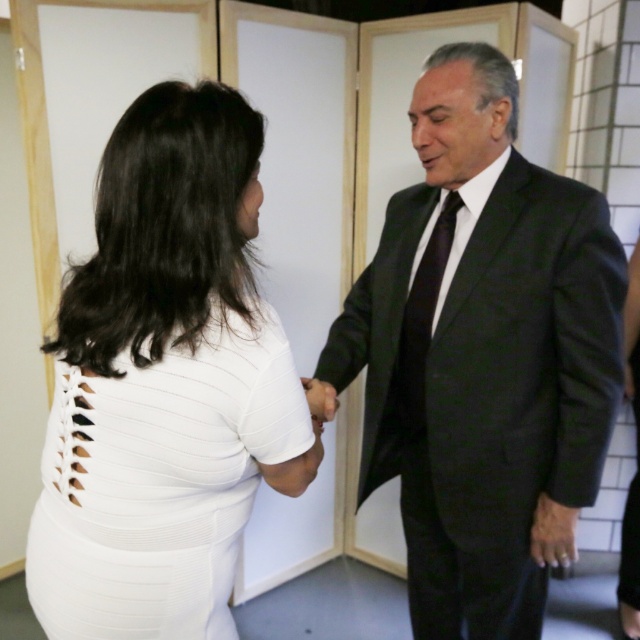
Question: Among these points, which one is nearest to the camera?

Choices:
 (A) (400, 336)
 (B) (326, 385)
 (C) (276, 426)
 (D) (451, 195)

Answer: (C)

Question: Is the position of dark gray suit at center less distant than that of black silk tie at right?

Choices:
 (A) yes
 (B) no

Answer: (A)

Question: Considering the real-world distances, which object is closest to the white textured dress at left?

Choices:
 (A) white matte hand at center
 (B) black silk tie at right
 (C) dark gray suit at center

Answer: (A)

Question: Does dark gray suit at center have a lesser width compared to black silk tie at right?

Choices:
 (A) yes
 (B) no

Answer: (B)

Question: Which object is the farthest from the black silk tie at right?

Choices:
 (A) white matte hand at center
 (B) dark gray suit at center

Answer: (A)

Question: Can you confirm if dark gray suit at center is smaller than white matte hand at center?

Choices:
 (A) no
 (B) yes

Answer: (A)